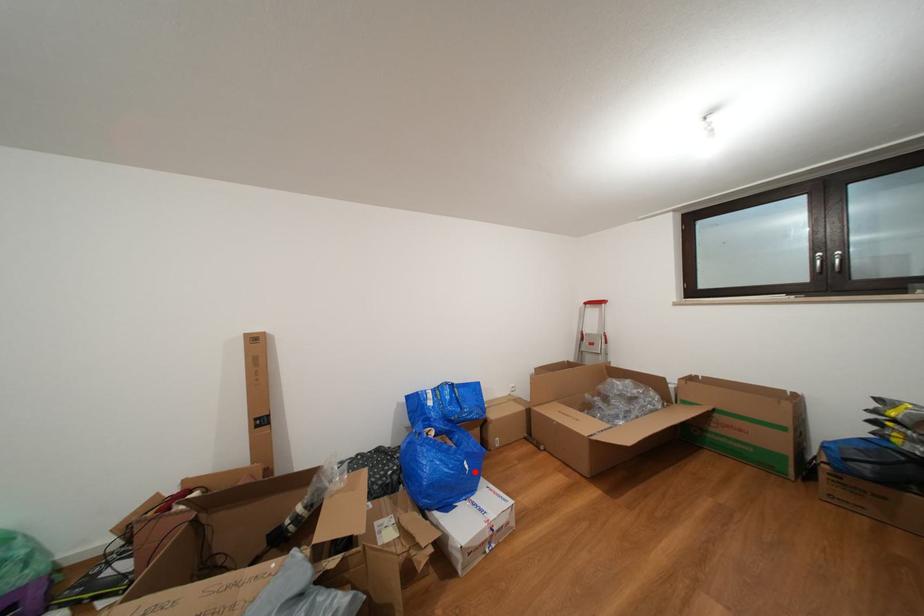
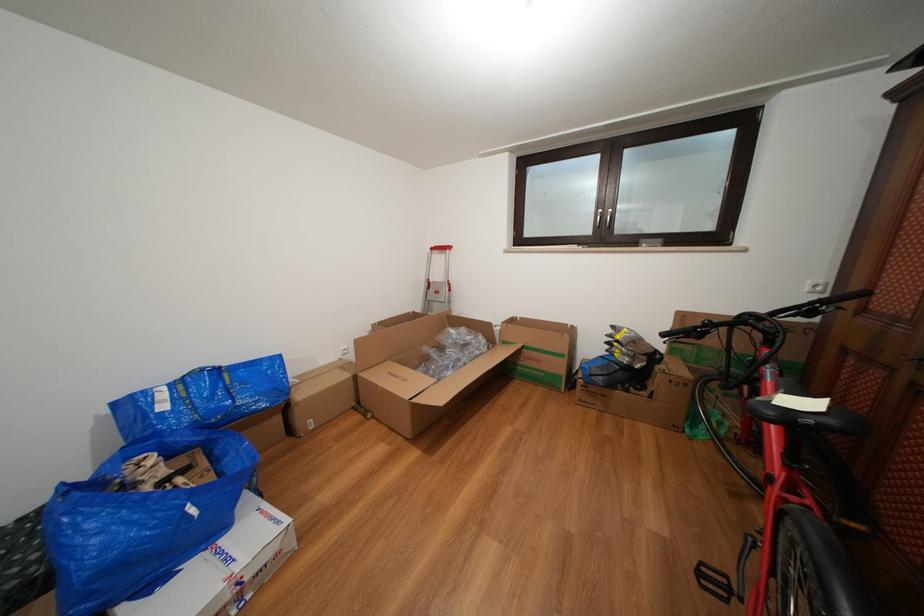
Find the pixel in the second image that matches the highlighted location in the first image.

(201, 516)